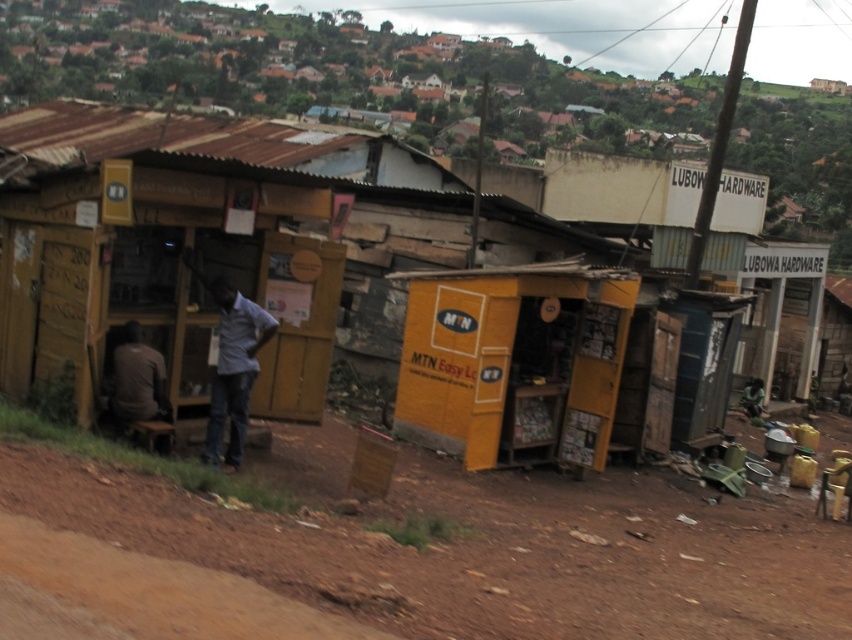
Question: Which object is farther from the camera taking this photo?

Choices:
 (A) light gray shirt at center
 (B) dark brown shirt at left

Answer: (A)

Question: Which point is farther to the camera?

Choices:
 (A) (118, 346)
 (B) (229, 348)
 (C) (400, 628)

Answer: (B)

Question: Estimate the real-world distances between objects in this image. Which object is farther from the brown dirt track at lower left?

Choices:
 (A) dark brown shirt at left
 (B) light gray shirt at center

Answer: (A)

Question: From the image, what is the correct spatial relationship of brown dirt track at lower left in relation to light gray shirt at center?

Choices:
 (A) left
 (B) right

Answer: (B)

Question: Does brown dirt track at lower left lie in front of light gray shirt at center?

Choices:
 (A) yes
 (B) no

Answer: (A)

Question: Where is brown dirt track at lower left located in relation to light gray shirt at center in the image?

Choices:
 (A) left
 (B) right

Answer: (B)